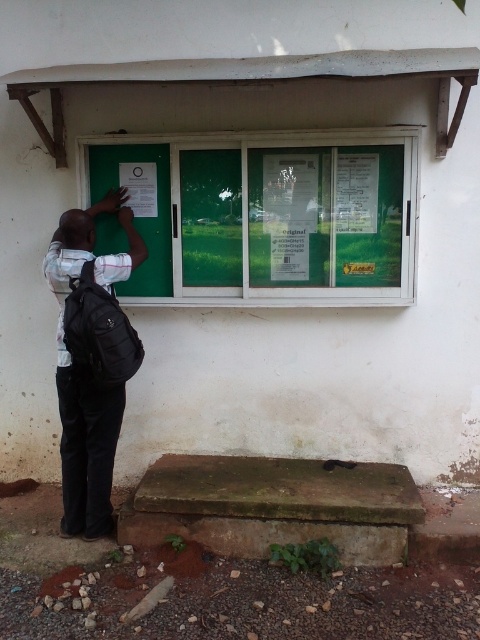
Question: Does green glass window at center appear under black backpack at left?

Choices:
 (A) yes
 (B) no

Answer: (B)

Question: Is green glass window at center to the left of black backpack at left from the viewer's perspective?

Choices:
 (A) no
 (B) yes

Answer: (A)

Question: Which point is farther to the camera?

Choices:
 (A) (315, 246)
 (B) (109, 385)

Answer: (A)

Question: Is green glass window at center bigger than black backpack at left?

Choices:
 (A) yes
 (B) no

Answer: (B)

Question: Which of the following is the closest to the observer?

Choices:
 (A) (242, 252)
 (B) (76, 492)

Answer: (B)